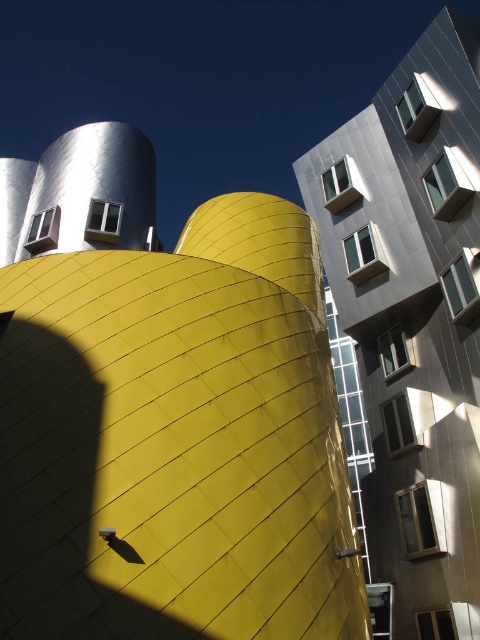
Does yellow matte building at center have a lesser width compared to metallic silver building at upper right?

No, yellow matte building at center is not thinner than metallic silver building at upper right.

Between yellow matte building at center and metallic silver building at upper right, which one has more height?

With more height is metallic silver building at upper right.

Image resolution: width=480 pixels, height=640 pixels. What do you see at coordinates (166, 412) in the screenshot? I see `yellow matte building at center` at bounding box center [166, 412].

Locate an element on the screen. yellow matte building at center is located at coordinates (166, 412).